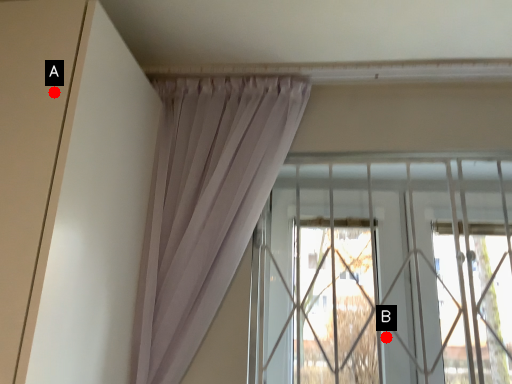
Question: Two points are circled on the image, labeled by A and B beside each circle. Which of the following is the farthest from the observer?

Choices:
 (A) A is further
 (B) B is further

Answer: (B)